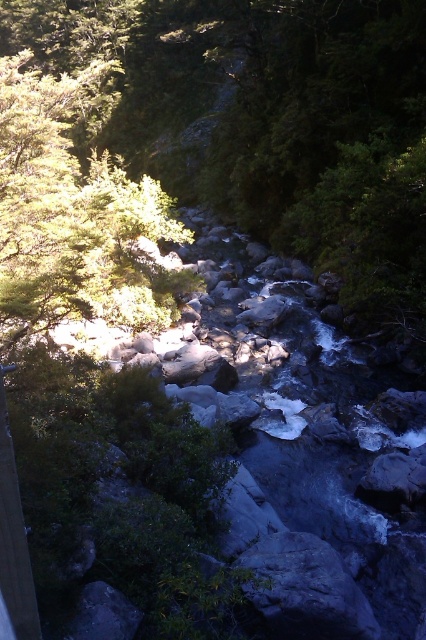
Is green matte tree at upper left positioned behind gray rock at center?

That is True.

Find the location of a particular element. This screenshot has width=426, height=640. green matte tree at upper left is located at coordinates (69, 216).

Where is `green matte tree at upper left`? green matte tree at upper left is located at coordinates (69, 216).

Does green leafy tree at center appear on the left side of gray rock at center?

Indeed, green leafy tree at center is positioned on the left side of gray rock at center.

The width and height of the screenshot is (426, 640). In order to click on green leafy tree at center in this screenshot , I will do `click(270, 122)`.

Identify the location of green leafy tree at center. This screenshot has width=426, height=640. point(270,122).

Can you confirm if green leafy tree at center is positioned above green matte tree at upper left?

Correct, green leafy tree at center is located above green matte tree at upper left.

Is green leafy tree at center taller than green matte tree at upper left?

Yes, green leafy tree at center is taller than green matte tree at upper left.

Between point (180, 122) and point (52, 196), which one is positioned in front?

Positioned in front is point (52, 196).

The height and width of the screenshot is (640, 426). What are the coordinates of `green leafy tree at center` in the screenshot? It's located at (270, 122).